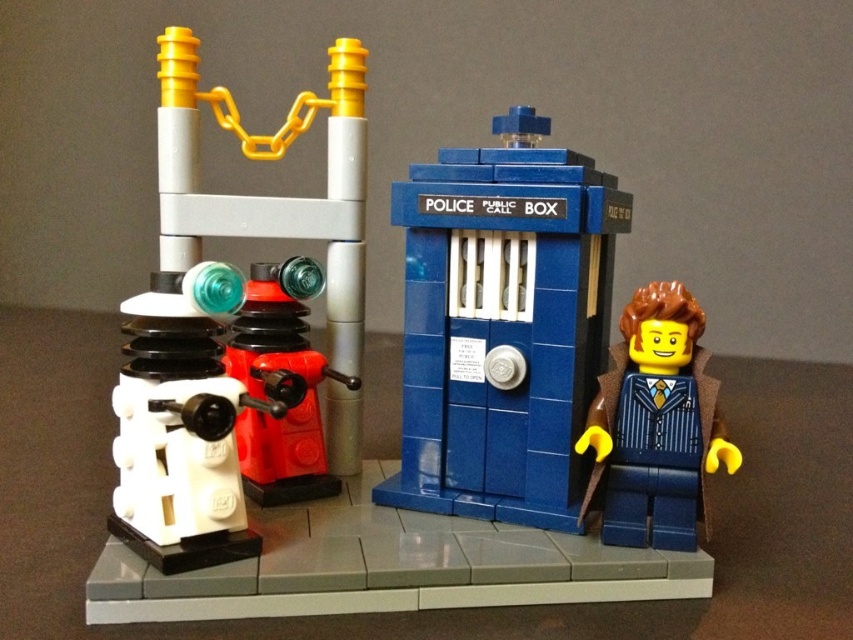
Is matte plastic dalek at left to the right of white plastic microscope at center-left from the viewer's perspective?

Yes, matte plastic dalek at left is to the right of white plastic microscope at center-left.

Which is in front, point (311, 109) or point (218, 474)?

Point (218, 474) is more forward.

Between point (183, 406) and point (181, 413), which one is positioned behind?

Positioned behind is point (183, 406).

I want to click on matte plastic dalek at left, so click(228, 314).

Who is taller, blue plastic police box at center or matte plastic dalek at left?

matte plastic dalek at left

At what (x,y) coordinates should I click in order to perform the action: click on blue plastic police box at center. Please return your answer as a coordinate pair (x, y). Looking at the image, I should click on (502, 324).

Who is shorter, blue plastic police box at center or white plastic microscope at center-left?

With less height is white plastic microscope at center-left.

Who is lower down, blue plastic police box at center or white plastic microscope at center-left?

white plastic microscope at center-left

Is point (474, 378) in front of point (218, 342)?

No.

This screenshot has width=853, height=640. In order to click on blue plastic police box at center in this screenshot , I will do `click(502, 324)`.